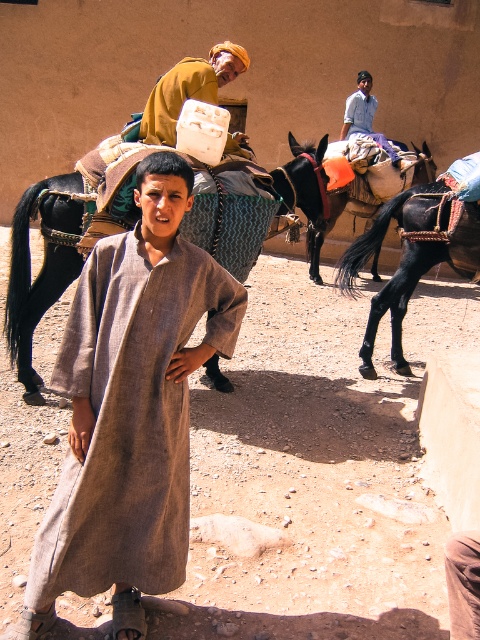
Who is positioned more to the right, yellow fabric turban at upper center or light blue shirt at upper center?

light blue shirt at upper center is more to the right.

Which is in front, point (199, 92) or point (344, 116)?

Point (199, 92)

Identify the location of yellow fabric turban at upper center. The height and width of the screenshot is (640, 480). (189, 88).

Can you confirm if black leather saddle at right is thinner than light blue shirt at upper center?

Correct, black leather saddle at right's width is less than light blue shirt at upper center's.

Looking at this image, which is below, black leather saddle at right or light blue shirt at upper center?

black leather saddle at right is lower down.

Is point (320, 248) more distant than point (365, 104)?

No, it is in front of (365, 104).

The image size is (480, 640). Identify the location of black leather saddle at right. (323, 236).

Which is behind, point (54, 531) or point (226, 58)?

The point (226, 58) is behind.

Find the location of a particular element. light brown woolen robe at center is located at coordinates (130, 419).

I want to click on light brown woolen robe at center, so click(130, 419).